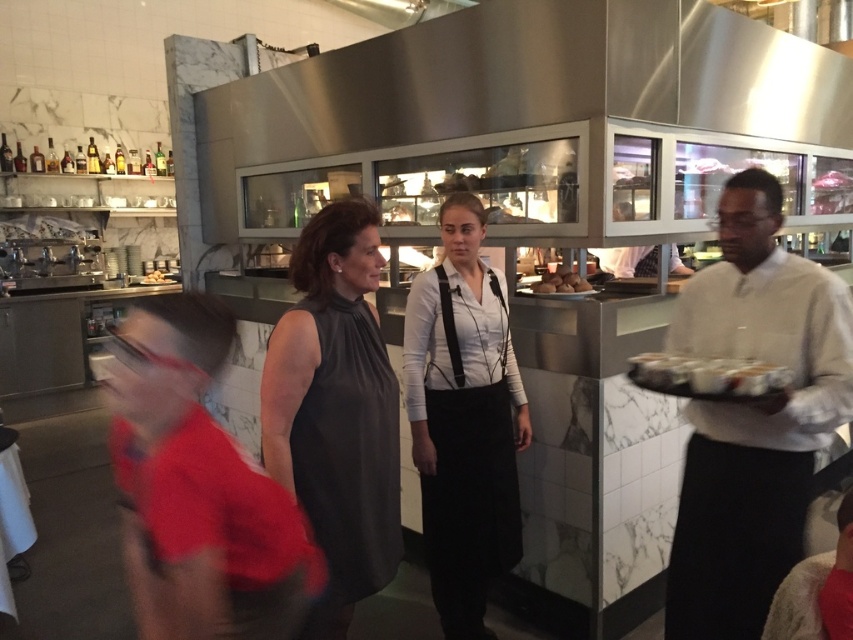
Question: Can you confirm if white matte sweater at right is bigger than golden brown bread at center?

Choices:
 (A) yes
 (B) no

Answer: (A)

Question: Is red shirt at lower left bigger than golden brown bread at center?

Choices:
 (A) no
 (B) yes

Answer: (B)

Question: Among these points, which one is nearest to the camera?

Choices:
 (A) (558, 275)
 (B) (686, 360)
 (C) (120, 412)
 (D) (366, 432)

Answer: (C)

Question: Which of the following is the farthest from the observer?

Choices:
 (A) smooth brown bread at center
 (B) white glossy tray at right

Answer: (A)

Question: Which object is closer to the camera taking this photo?

Choices:
 (A) golden brown bread at center
 (B) white matte shirt at center
 (C) white glossy tray at right
 (D) dark gray sleeveless dress at center

Answer: (D)

Question: Does red shirt at lower left have a larger size compared to white glossy tray at right?

Choices:
 (A) yes
 (B) no

Answer: (A)